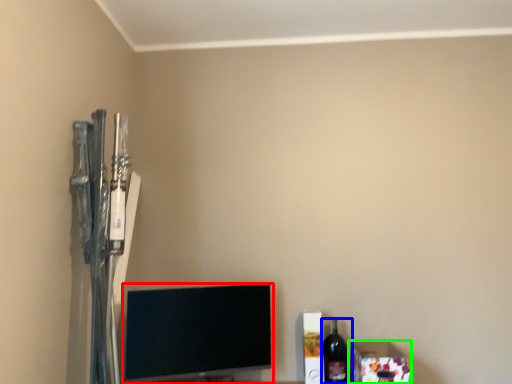
Question: Which is nearer to the television (highlighted by a red box)? bottle (highlighted by a blue box) or box (highlighted by a green box).

Choices:
 (A) bottle
 (B) box

Answer: (A)